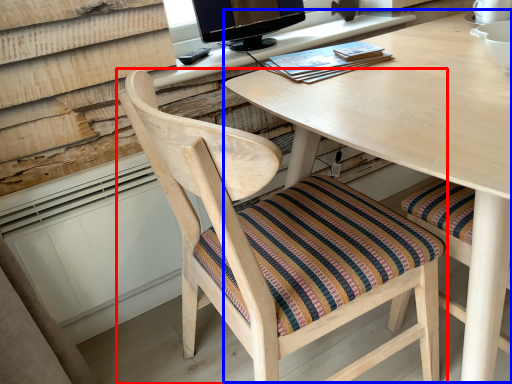
Question: Which of the following is the closest to the observer, chair (highlighted by a red box) or computer desk (highlighted by a blue box)?

Choices:
 (A) chair
 (B) computer desk

Answer: (A)